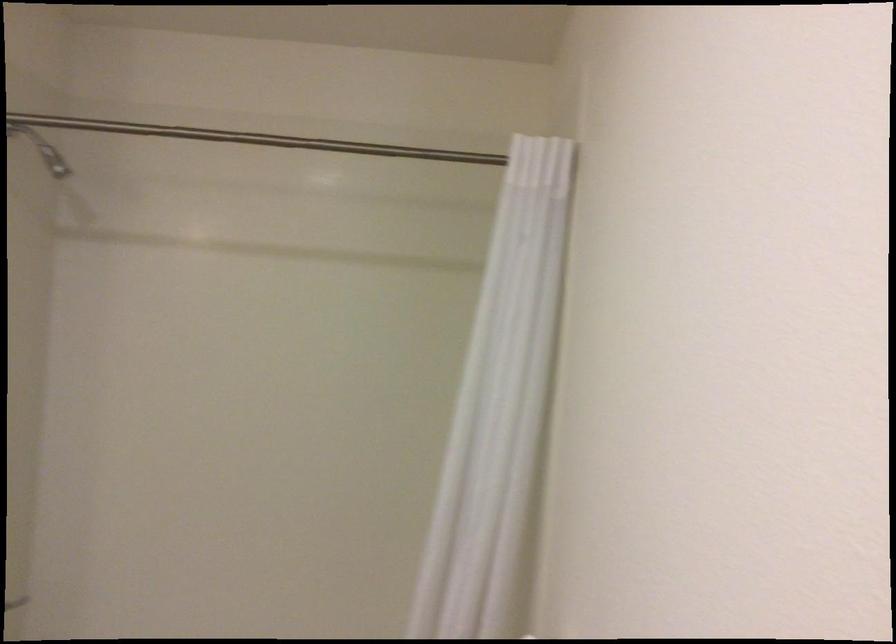
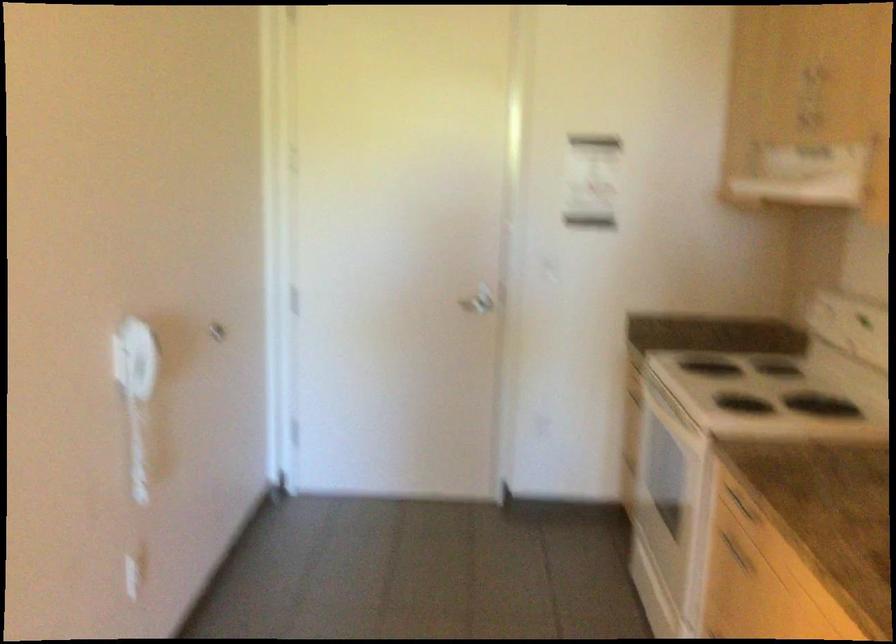
Question: I am providing you with two images of the same scene from different viewpoints. After the viewpoint changes to image2, which objects are now occluded?

Choices:
 (A) drawer handle
 (B) white shower curtain
 (C) red dotted tie
 (D) silver door handle

Answer: (B)